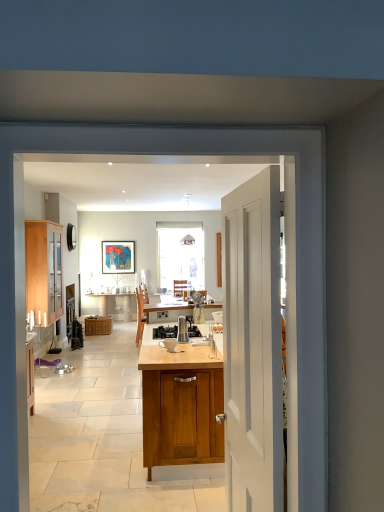
Question: Is wooden cabinet at center turned away from light wood/glass cabinet at left?

Choices:
 (A) yes
 (B) no

Answer: (B)

Question: From the image's perspective, is wooden cabinet at center above light wood/glass cabinet at left?

Choices:
 (A) no
 (B) yes

Answer: (A)

Question: Is light wood/glass cabinet at left located within wooden cabinet at center?

Choices:
 (A) no
 (B) yes

Answer: (A)

Question: Could you tell me if wooden cabinet at center is turned towards light wood/glass cabinet at left?

Choices:
 (A) no
 (B) yes

Answer: (B)

Question: Can you confirm if wooden cabinet at center is wider than light wood/glass cabinet at left?

Choices:
 (A) no
 (B) yes

Answer: (A)

Question: Considering the positions of wooden cabinet at center and white matte door at center in the image, is wooden cabinet at center bigger or smaller than white matte door at center?

Choices:
 (A) small
 (B) big

Answer: (B)

Question: From a real-world perspective, is wooden cabinet at center physically located above or below white matte door at center?

Choices:
 (A) below
 (B) above

Answer: (B)

Question: Is wooden cabinet at center taller or shorter than white matte door at center?

Choices:
 (A) tall
 (B) short

Answer: (B)

Question: Do you think wooden cabinet at center is within white matte door at center, or outside of it?

Choices:
 (A) outside
 (B) inside

Answer: (A)

Question: Is satin silver coffee maker at center inside or outside of woven brown picnic basket at center?

Choices:
 (A) outside
 (B) inside

Answer: (A)

Question: Considering the relative positions of satin silver coffee maker at center and woven brown picnic basket at center in the image provided, is satin silver coffee maker at center to the left or to the right of woven brown picnic basket at center?

Choices:
 (A) right
 (B) left

Answer: (A)

Question: Does point (178, 330) appear closer or farther from the camera than point (102, 324)?

Choices:
 (A) closer
 (B) farther

Answer: (A)

Question: Is satin silver coffee maker at center taller or shorter than woven brown picnic basket at center?

Choices:
 (A) tall
 (B) short

Answer: (B)

Question: Looking at their shapes, would you say woven brown picnic basket at center is wider or thinner than satin silver coffee maker at center?

Choices:
 (A) wide
 (B) thin

Answer: (A)

Question: Is woven brown picnic basket at center spatially inside satin silver coffee maker at center, or outside of it?

Choices:
 (A) outside
 (B) inside

Answer: (A)